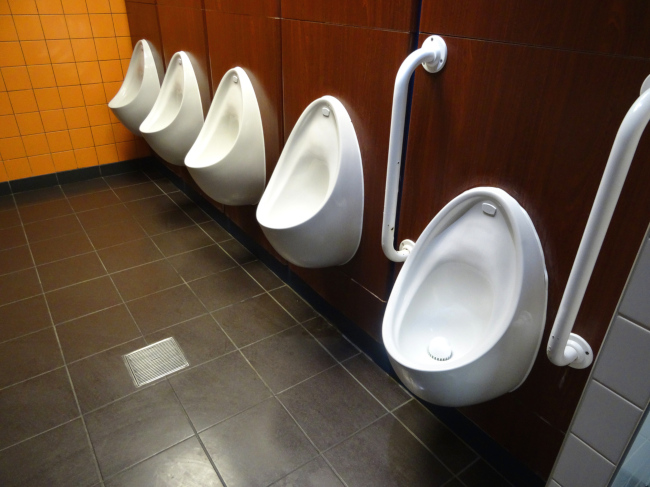
I want to click on urinals, so click(x=136, y=84), click(x=177, y=108), click(x=224, y=138), click(x=304, y=180), click(x=486, y=288).